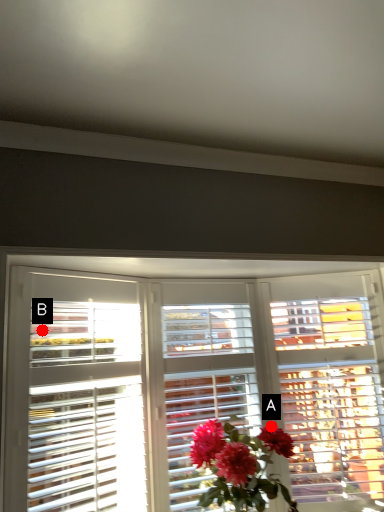
Question: Two points are circled on the image, labeled by A and B beside each circle. Which point is closer to the camera taking this photo?

Choices:
 (A) A is closer
 (B) B is closer

Answer: (B)